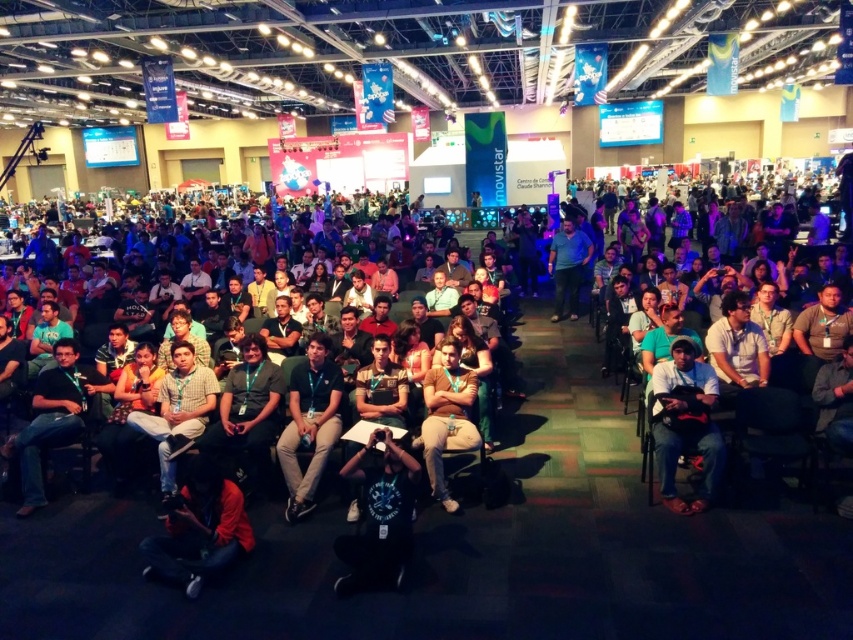
Which is above, dark blue jeans at center or brown cotton shirt at center?

dark blue jeans at center is above.

Can you confirm if dark blue jeans at center is smaller than brown cotton shirt at center?

Actually, dark blue jeans at center might be larger than brown cotton shirt at center.

The image size is (853, 640). What do you see at coordinates (685, 422) in the screenshot?
I see `dark blue jeans at center` at bounding box center [685, 422].

Where is `dark blue jeans at center`? The image size is (853, 640). dark blue jeans at center is located at coordinates (685, 422).

Is the position of brown cotton shirt at center more distant than that of blue cotton shirt at center?

No, brown cotton shirt at center is in front of blue cotton shirt at center.

Who is positioned more to the left, brown cotton shirt at center or blue cotton shirt at center?

→ Positioned to the left is brown cotton shirt at center.

Locate an element on the screen. The height and width of the screenshot is (640, 853). brown cotton shirt at center is located at coordinates 447,417.

Is green fabric shirt at center bigger than blue cotton shirt at center?

No.

What do you see at coordinates (309, 422) in the screenshot? I see `green fabric shirt at center` at bounding box center [309, 422].

Does point (305, 372) lie in front of point (554, 310)?

Yes, point (305, 372) is closer to viewer.

Locate an element on the screen. green fabric shirt at center is located at coordinates (309, 422).